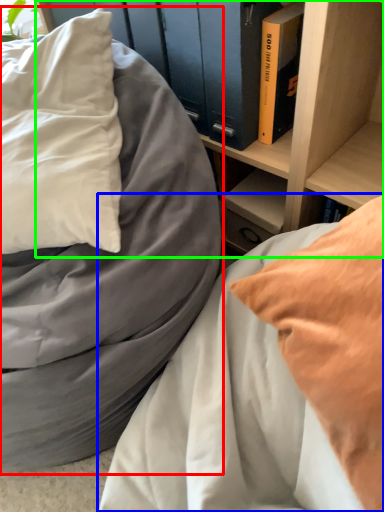
Question: Based on their relative distances, which object is farther from bed (highlighted by a red box)? Choose from bed (highlighted by a blue box) and shelf (highlighted by a green box).

Choices:
 (A) bed
 (B) shelf

Answer: (B)